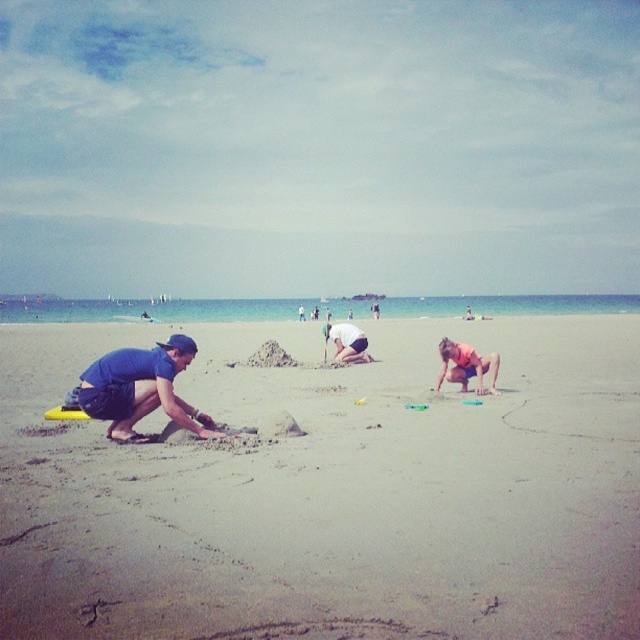
Is sandy beach at lower left in front of blue fabric shirt at lower left?

That is True.

Locate an element on the screen. The width and height of the screenshot is (640, 640). sandy beach at lower left is located at coordinates click(x=333, y=492).

This screenshot has width=640, height=640. What do you see at coordinates (333, 492) in the screenshot? I see `sandy beach at lower left` at bounding box center [333, 492].

The image size is (640, 640). What are the coordinates of `sandy beach at lower left` in the screenshot? It's located at (333, 492).

I want to click on sandy beach at lower left, so click(333, 492).

Can you confirm if sandy beach at lower left is taller than matte blue shorts at center?

Correct, sandy beach at lower left is much taller as matte blue shorts at center.

Locate an element on the screen. Image resolution: width=640 pixels, height=640 pixels. sandy beach at lower left is located at coordinates (333, 492).

Between sandy beach at lower left and orange fabric shorts at lower right, which one is positioned higher?

Positioned higher is orange fabric shorts at lower right.

Looking at this image, between sandy beach at lower left and orange fabric shorts at lower right, which one appears on the left side from the viewer's perspective?

Positioned to the left is sandy beach at lower left.

Is point (442, 602) positioned before point (445, 340)?

Yes, point (442, 602) is in front of point (445, 340).

This screenshot has height=640, width=640. Identify the location of sandy beach at lower left. (333, 492).